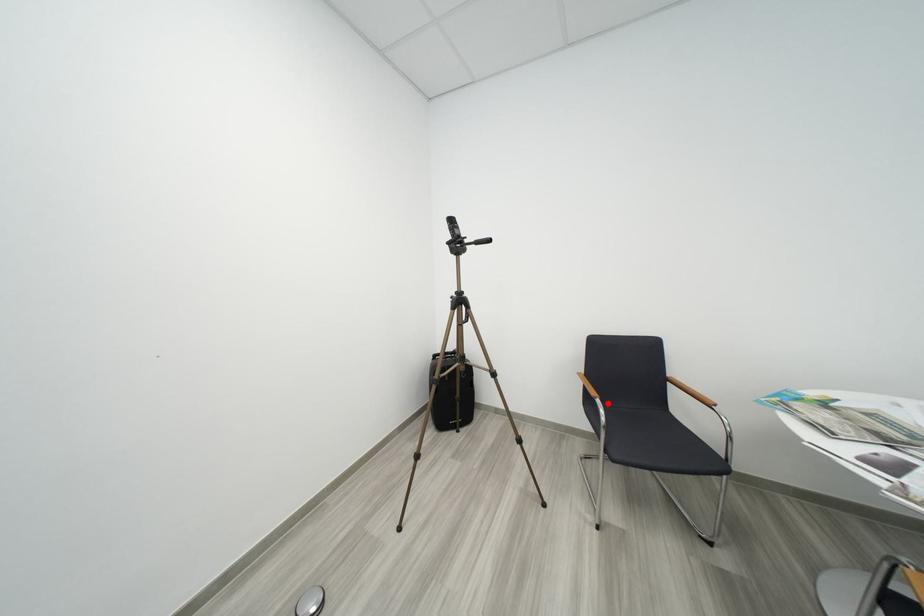
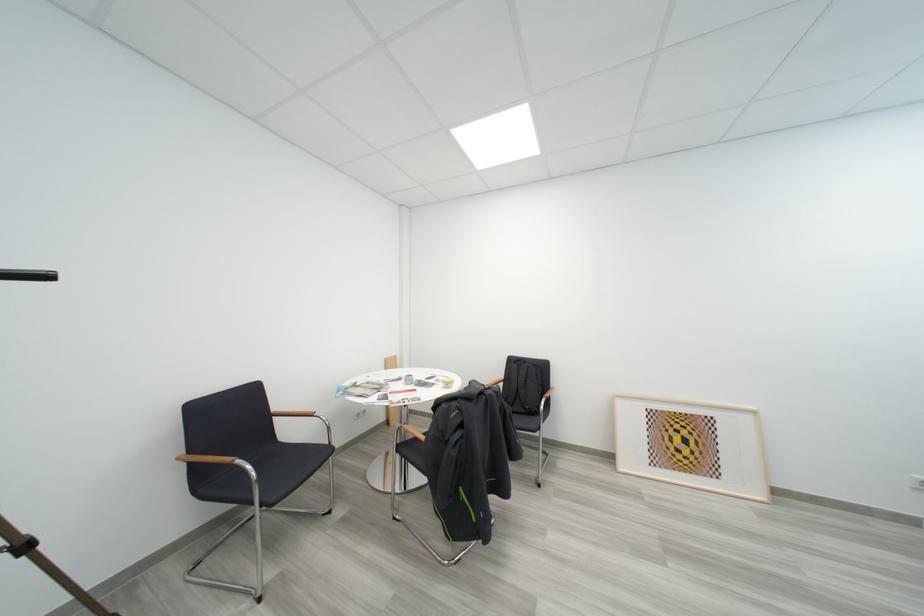
Find the pixel in the second image that matches the highlighted location in the first image.

(247, 464)